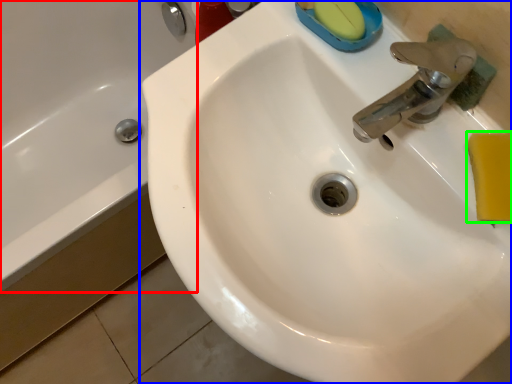
Question: Which object is the farthest from bath (highlighted by a red box)? Choose among these: sink (highlighted by a blue box) or soap (highlighted by a green box).

Choices:
 (A) sink
 (B) soap

Answer: (B)